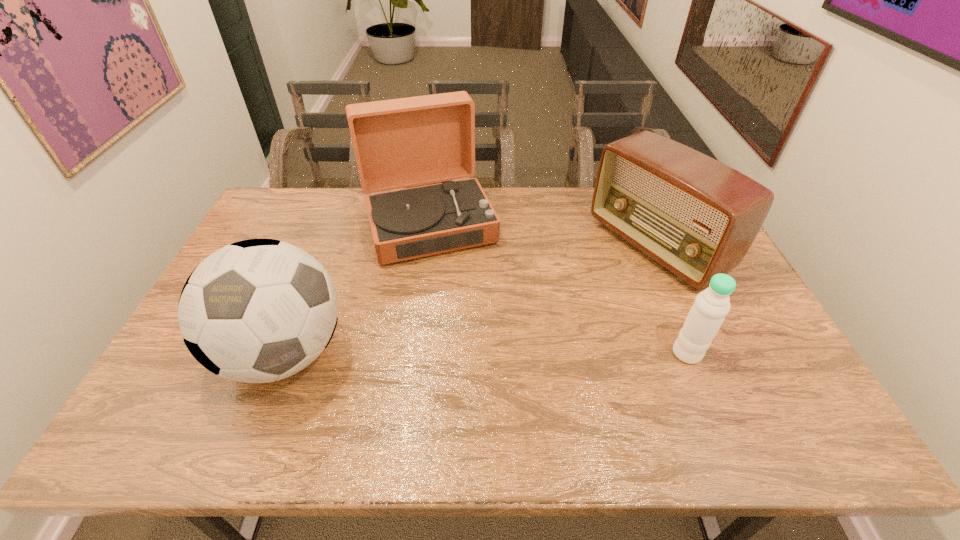
The width and height of the screenshot is (960, 540). In order to click on soccer ball in this screenshot , I will do `click(259, 310)`.

In order to click on the shortest object in this screenshot , I will do `click(708, 312)`.

Find the location of a particular element. This screenshot has width=960, height=540. radio receiver is located at coordinates (697, 217).

The height and width of the screenshot is (540, 960). In order to click on phonograph record in this screenshot , I will do `click(398, 143)`.

I want to click on vacant space located 0.300m on the back of the water bottle, so click(x=651, y=265).

This screenshot has height=540, width=960. I want to click on vacant space located 0.370m on the front-facing side of the radio receiver, so click(517, 327).

At what (x,y) coordinates should I click in order to perform the action: click on free space located on the front-facing side of the radio receiver. Please return your answer as a coordinate pair (x, y). Looking at the image, I should click on (575, 295).

Find the location of a particular element. vacant space situated 0.320m on the front-facing side of the radio receiver is located at coordinates (532, 319).

Identify the location of vacant region located 0.100m on the face of the phonograph record. The width and height of the screenshot is (960, 540). (454, 288).

This screenshot has height=540, width=960. Find the location of `vacant space located on the face of the phonograph record`. vacant space located on the face of the phonograph record is located at coordinates click(460, 305).